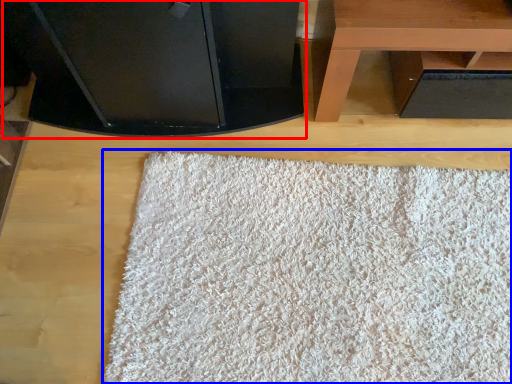
Question: Which point is closer to the camera, furniture (highlighted by a red box) or mat (highlighted by a blue box)?

Choices:
 (A) furniture
 (B) mat

Answer: (A)